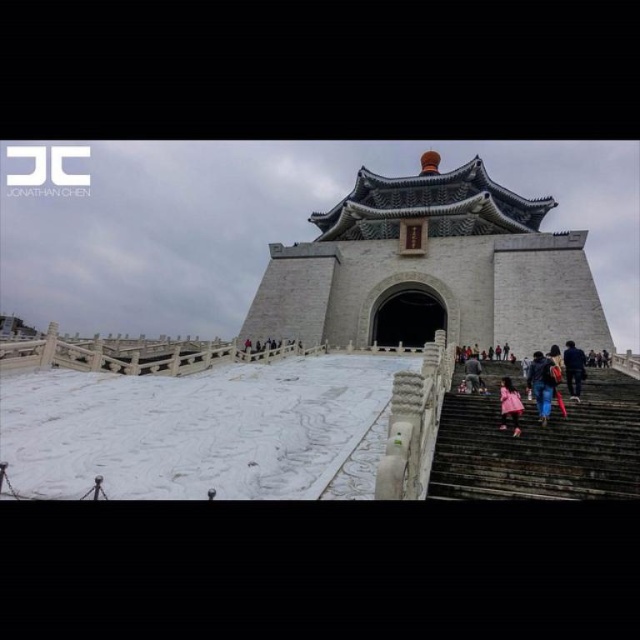
Does pink fabric at stairs right appear under dark blue jeans at lower right?

Correct, pink fabric at stairs right is located below dark blue jeans at lower right.

This screenshot has width=640, height=640. Describe the element at coordinates (509, 404) in the screenshot. I see `pink fabric at stairs right` at that location.

Find the location of `pink fabric at stairs right`. pink fabric at stairs right is located at coordinates (509, 404).

Between pink fabric at stairs right and pink fabric at lower center, which one is positioned higher?

Positioned higher is pink fabric at lower center.

Which is behind, point (500, 384) or point (476, 372)?

Point (476, 372)

Which is behind, point (500, 413) or point (474, 372)?

Positioned behind is point (474, 372).

At what (x,y) coordinates should I click in order to perform the action: click on pink fabric at stairs right. Please return your answer as a coordinate pair (x, y). This screenshot has height=640, width=640. Looking at the image, I should click on point(509,404).

Can you confirm if white stone tower at center is positioned to the left of dark blue jeans at lower right?

Indeed, white stone tower at center is positioned on the left side of dark blue jeans at lower right.

Can you confirm if white stone tower at center is taller than dark blue jeans at lower right?

Yes.

Is point (438, 234) less distant than point (573, 353)?

No, (438, 234) is behind (573, 353).

Image resolution: width=640 pixels, height=640 pixels. I want to click on white stone tower at center, so click(429, 268).